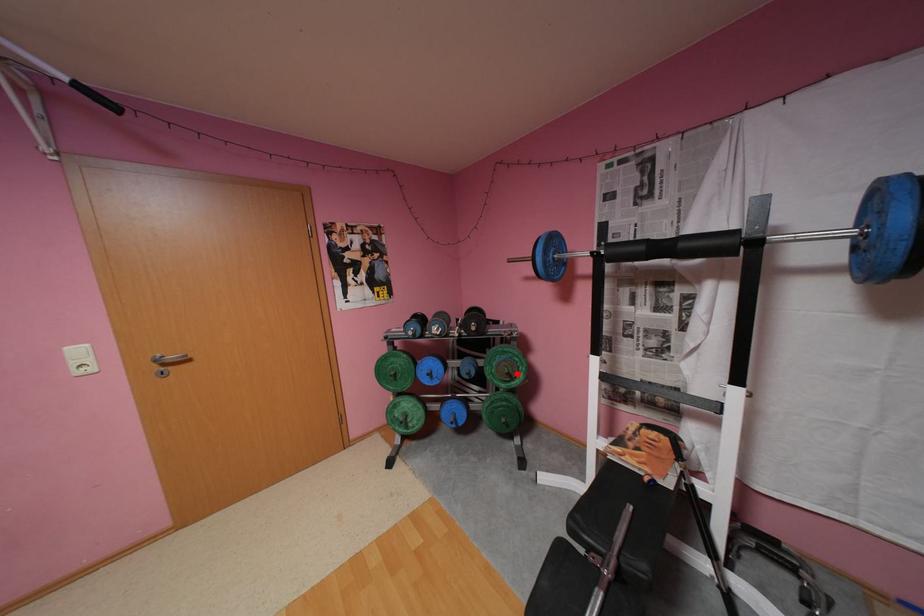
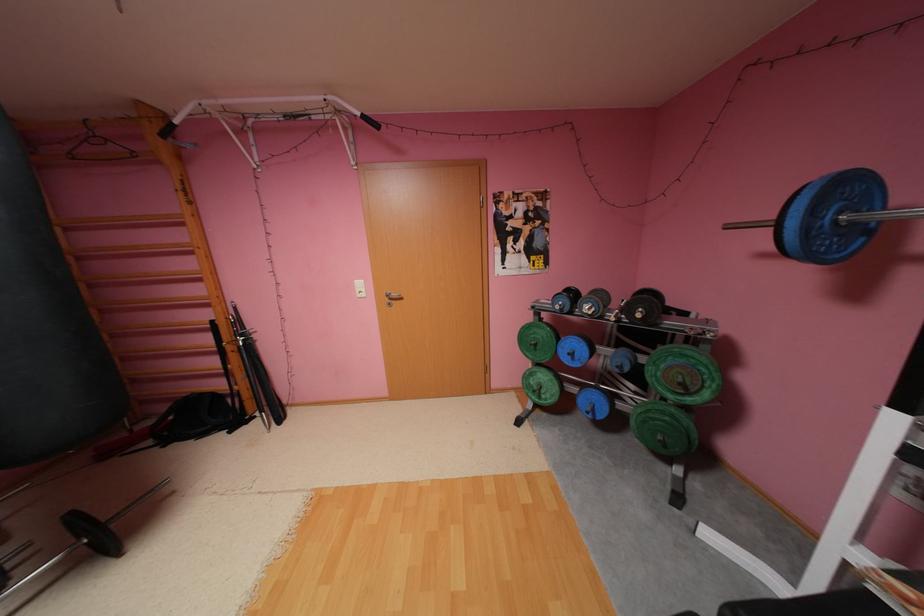
The point at the highlighted location is marked in the first image. Where is the corresponding point in the second image?

(690, 384)